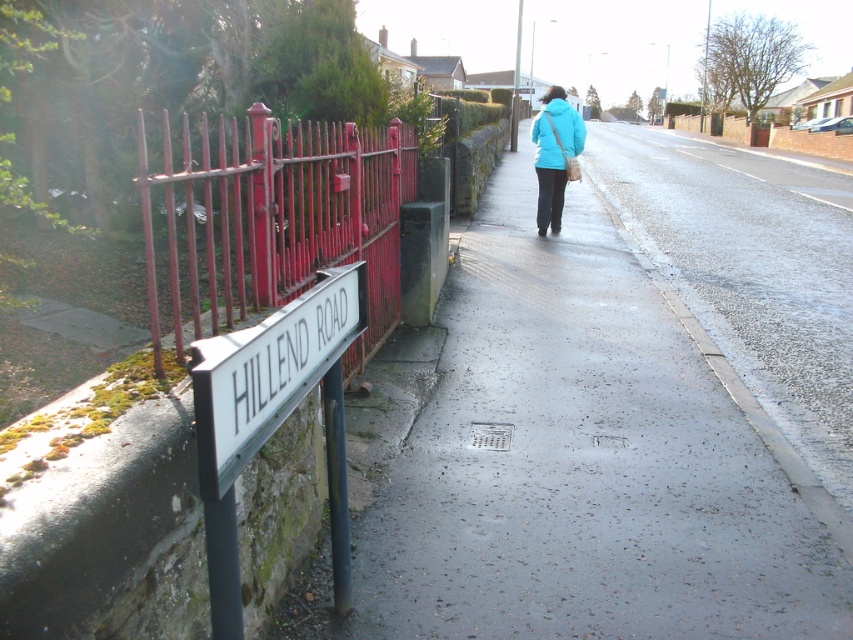
Based on the photo, you are a pedestrian walking along the sidewalk on HILLEND ROAD. You notice a white plastic sign at left and a matte blue jacket at center. Which object is closer to the ground?

The white plastic sign at left is positioned under the matte blue jacket at center, so the white plastic sign at left is closer to the ground.

You are standing at the center of the image and want to locate the red painted metal fence at left. Which direction should you look to find it?

The red painted metal fence at left is located at point (270,218), so you should look to the left side of the image to find it.